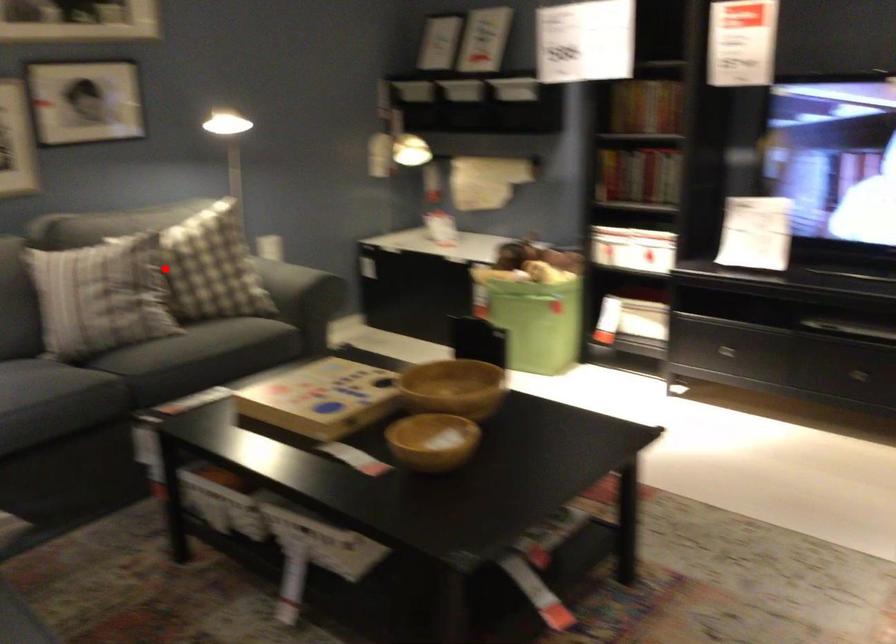
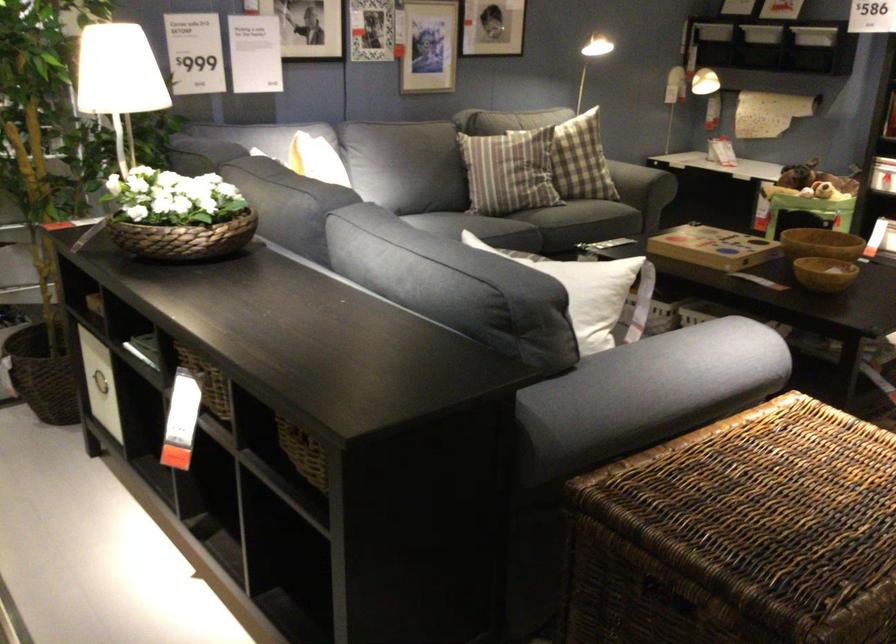
Question: I am providing you with two images of the same scene from different viewpoints. In image1, a red point is highlighted. Considering the same 3D point in image2, which of the following is correct?

Choices:
 (A) It is closer
 (B) It is farther

Answer: (B)